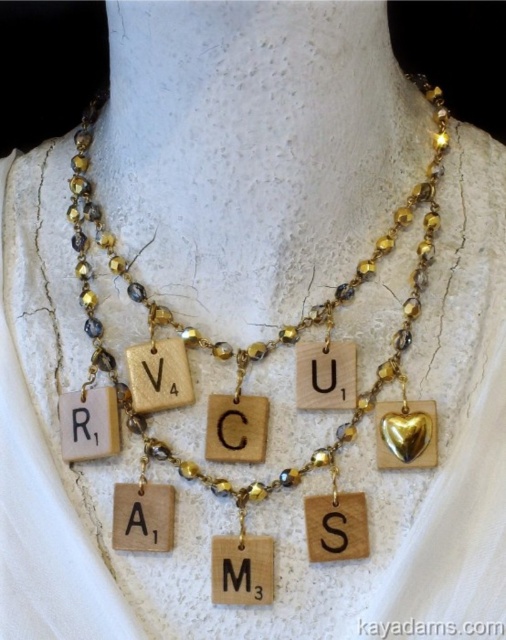
Question: Which of the following is the farthest from the observer?

Choices:
 (A) (294, 474)
 (B) (148, 374)

Answer: (B)

Question: Does matte gold letter m at center come in front of wooden letter at center?

Choices:
 (A) no
 (B) yes

Answer: (B)

Question: Which point is closer to the camera?

Choices:
 (A) (142, 362)
 (B) (249, 564)
 (C) (300, 472)

Answer: (B)

Question: In this image, where is matte gold letter m at center located relative to wooden letter at center?

Choices:
 (A) right
 (B) left

Answer: (A)

Question: Which of the following is the farthest from the observer?

Choices:
 (A) (155, 390)
 (B) (118, 381)
 (C) (225, 557)

Answer: (B)

Question: Observing the image, what is the correct spatial positioning of wooden scrabble tiles at center in reference to matte gold letter m at center?

Choices:
 (A) below
 (B) above

Answer: (B)